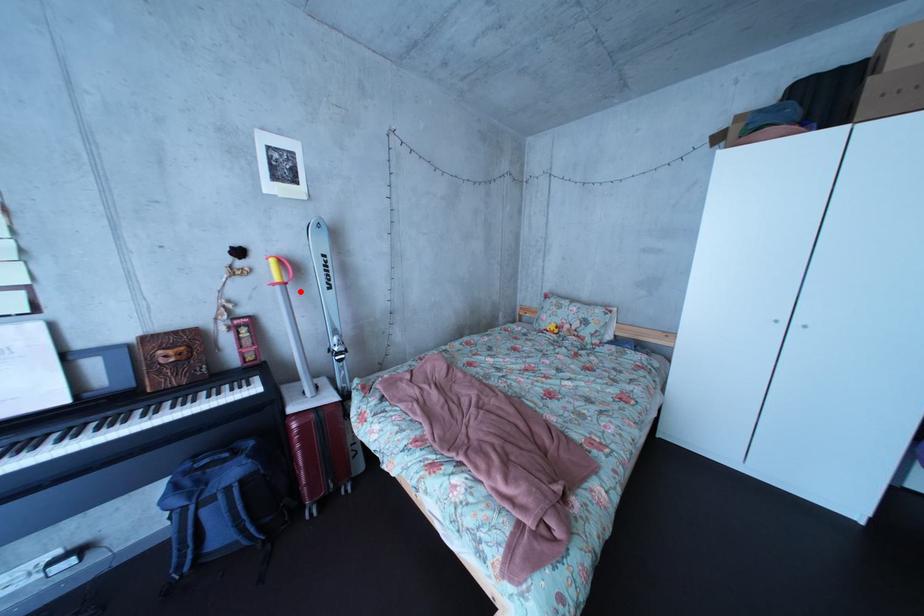
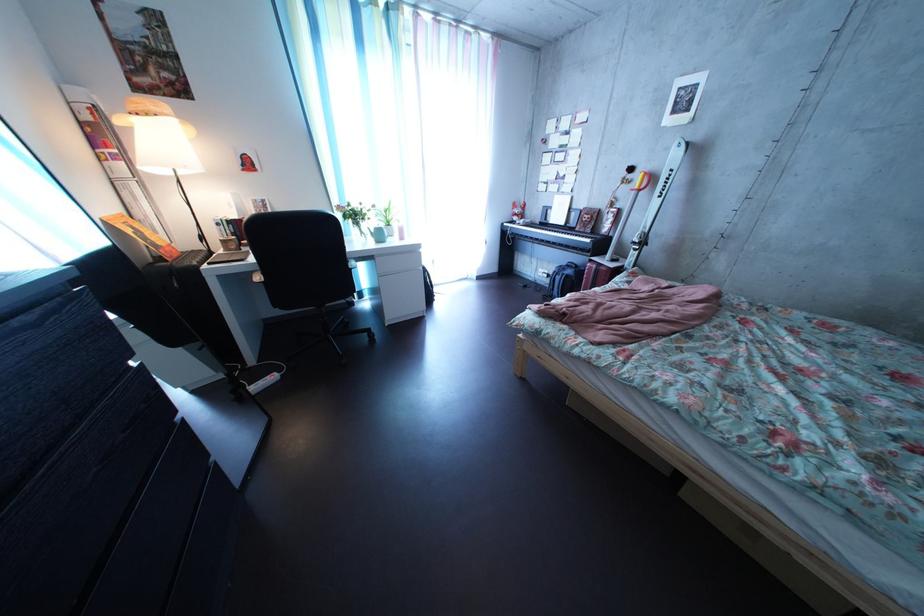
Locate, in the second image, the point that corresponds to the highlighted location in the first image.

(653, 199)